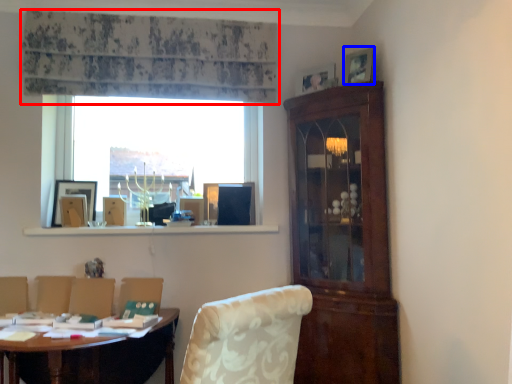
Question: Which of the following is the closest to the observer, curtain (highlighted by a red box) or picture frame (highlighted by a blue box)?

Choices:
 (A) curtain
 (B) picture frame

Answer: (B)